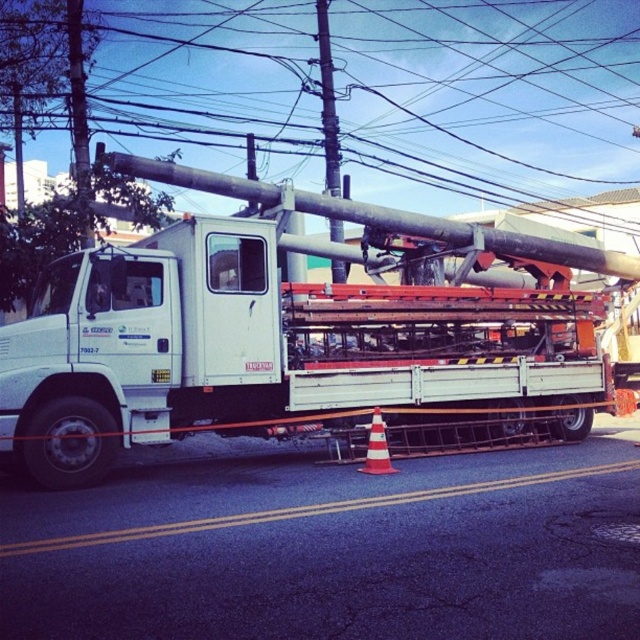
You are a delivery driver who needs to park your white matte trailer truck at center as close as possible to the brushed metal pole at center without touching it. What is the closest distance you can park the truck to the pole?

The closest distance you can park the white matte trailer truck at center to the brushed metal pole at center is 13.61 feet, as that is the current distance between them and you cannot park any closer without touching it.

You are a delivery driver who needs to park your truck under a low clearance bridge. The bridge has a height restriction sign stating that vehicles taller than 4 meters are not allowed. You observe the white matte trailer truck at center and the orange reflective traffic cone at lower center in your truck bed. Knowing that the traffic cone is exactly 0.5 meters tall, can you determine if your truck exceeds the bridge height limit?

The white matte trailer truck at center is taller than orange reflective traffic cone at lower center, which is 0.5 meters tall. Since the truck is taller than the cone, it is over 0.5 meters in height. However, the exact height of the truck isn is not provided. Without knowing the truckis actual height compared to the 4 meter limit, it is impossible to determine if it exceeds the bridge height restriction.

You are driving a car and see the white matte trailer truck at center and the orange reflective traffic cone at lower center. Which object is closer to the right side of the road?

The white matte trailer truck at center is to the right of the orange reflective traffic cone at lower center, so the white matte trailer truck at center is closer to the right side of the road.